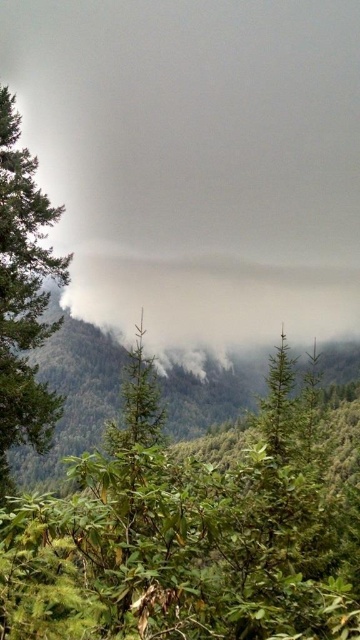
Question: Is green leafy tree at center to the right of green matte tree at left from the viewer's perspective?

Choices:
 (A) yes
 (B) no

Answer: (A)

Question: Estimate the real-world distances between objects in this image. Which object is closer to the green leafy tree at center?

Choices:
 (A) green matte tree at left
 (B) gray foggy cloud at center

Answer: (A)

Question: Is gray foggy cloud at center positioned at the back of green leafy tree at center?

Choices:
 (A) yes
 (B) no

Answer: (A)

Question: Does gray foggy cloud at center appear on the left side of green leafy tree at center?

Choices:
 (A) yes
 (B) no

Answer: (B)

Question: Which object appears closest to the camera in this image?

Choices:
 (A) gray foggy cloud at center
 (B) green matte tree at left
 (C) green leafy tree at center

Answer: (C)

Question: Which object is farther from the camera taking this photo?

Choices:
 (A) gray foggy cloud at center
 (B) green matte tree at left
 (C) green leafy tree at center

Answer: (A)